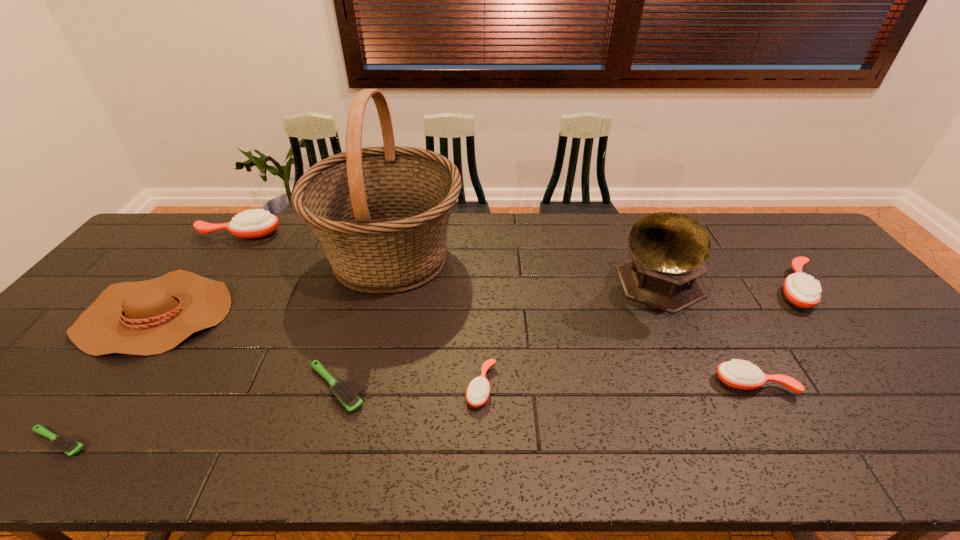
The width and height of the screenshot is (960, 540). I want to click on vacant space located on the back of the third biggest orange hairbrush, so click(x=702, y=291).

Locate an element on the screen. free spot located on the left of the second orange hairbrush from left to right is located at coordinates (415, 387).

You are a GUI agent. You are given a task and a screenshot of the screen. Output one action in this format:
    pyautogui.click(x=<x>, y=<y>)
    Task: Click on the free space located on the right of the third hairbrush from left to right
    
    Given the screenshot: What is the action you would take?
    pyautogui.click(x=389, y=388)

The width and height of the screenshot is (960, 540). I want to click on free space located on the back of the nearest object, so click(x=129, y=351).

What are the coordinates of `basket that is positioned at the far edge` in the screenshot? It's located at (381, 214).

At what (x,y) coordinates should I click in order to perform the action: click on phonograph record that is at the far edge. Please return your answer as a coordinate pair (x, y). The height and width of the screenshot is (540, 960). Looking at the image, I should click on (668, 249).

This screenshot has width=960, height=540. In order to click on hairbrush present at the far edge in this screenshot , I will do `click(252, 223)`.

Find the location of a particular element. Image resolution: width=960 pixels, height=540 pixels. object present at the near edge is located at coordinates (65, 443).

Find the location of `cowboy hat that is at the left edge`. cowboy hat that is at the left edge is located at coordinates (150, 317).

Identify the location of object present at the right edge. (802, 290).